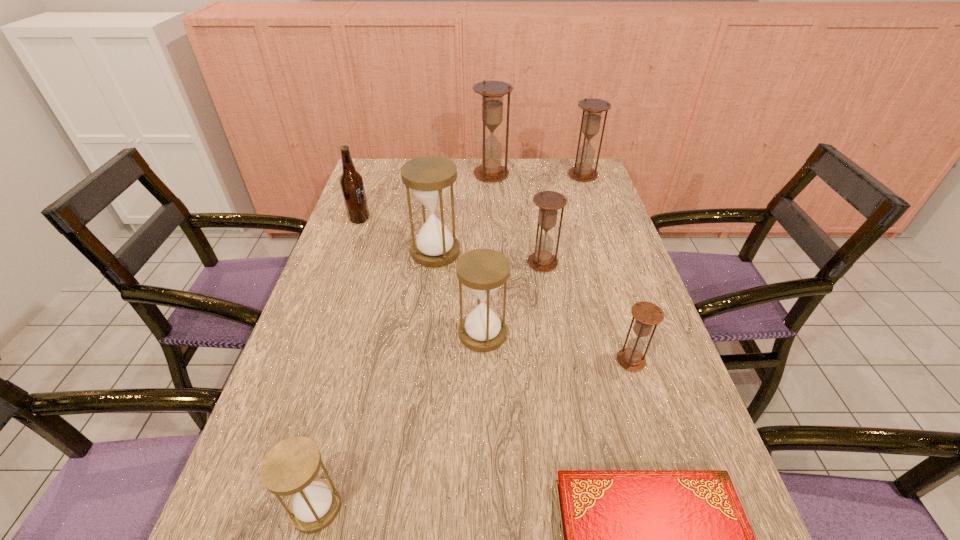
I want to click on the tallest hourglass, so click(492, 92).

Find the location of a particular element. The height and width of the screenshot is (540, 960). the biggest brown hourglass is located at coordinates (492, 92).

Find the location of a particular element. Image resolution: width=960 pixels, height=540 pixels. the second biggest brown hourglass is located at coordinates (592, 108).

Find the location of `the second hourglass from left to right`. the second hourglass from left to right is located at coordinates (429, 177).

The image size is (960, 540). What are the coordinates of `the biggest white hourglass` in the screenshot? It's located at (429, 177).

Locate an element on the screen. the third farthest object is located at coordinates (351, 182).

The image size is (960, 540). What are the coordinates of `the leftmost object` in the screenshot? It's located at (351, 182).

The width and height of the screenshot is (960, 540). Find the location of `the second brown hourglass from left to right`. the second brown hourglass from left to right is located at coordinates (x=549, y=202).

The width and height of the screenshot is (960, 540). Identify the location of the third biggest brown hourglass. (549, 202).

Locate an element on the screen. This screenshot has width=960, height=540. the second nearest white hourglass is located at coordinates (483, 271).